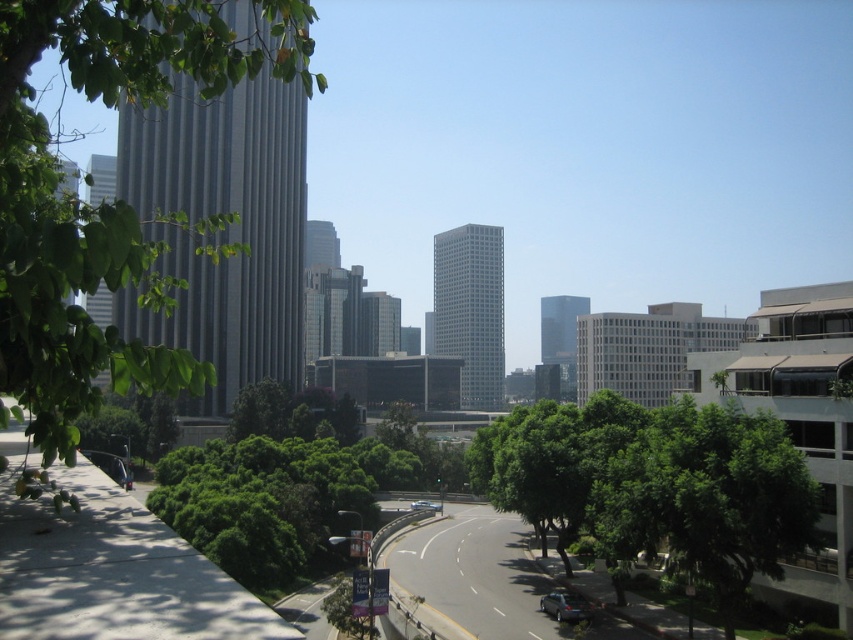
You are a pedestrian standing on the curved road in the foreground of the urban scene. You want to walk from the green leafy tree at left to the green leafy tree at center. In which direction should you head?

You should head to the right because the green leafy tree at center is to the right of the green leafy tree at left.

You are a photographer standing at the edge of the curved road. You want to take a photo that includes both the green leafy tree at left and the shiny silver sedan at lower center. Which object will appear larger in the photo?

The green leafy tree at left will appear larger in the photo because it is much taller than the shiny silver sedan at lower center.

You are a photographer planning to take a picture of the shiny silver sedan at lower center and the green leafy tree at left. Which object should you focus on first if you want the closer one to be in sharp focus?

The green leafy tree at left should be focused on first because it is closer to the photographer than the shiny silver sedan at lower center.